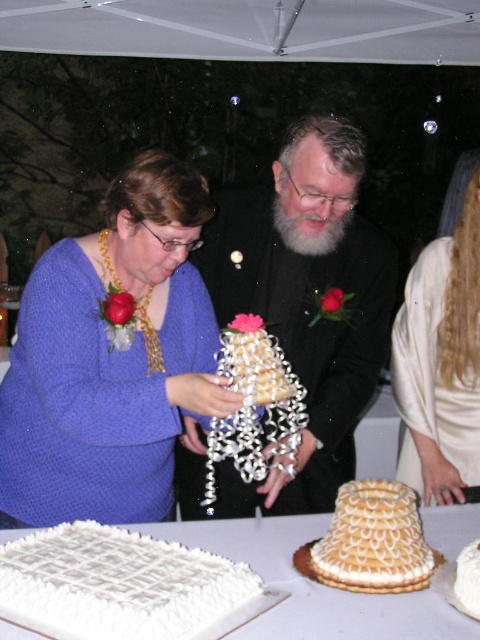
Is point (91, 284) closer to viewer compared to point (441, 556)?

No, (91, 284) is further to viewer.

From the picture: Is matte purple dress at center positioned in front of golden textured cake at center?

No.

I want to click on matte purple dress at center, so click(111, 358).

You are a GUI agent. You are given a task and a screenshot of the screen. Output one action in this format:
    pyautogui.click(x=<x>, y=<y>)
    Task: Click on the matte purple dress at center
    Image resolution: width=480 pixels, height=640 pixels.
    Given the screenshot: What is the action you would take?
    pyautogui.click(x=111, y=358)

Based on the photo, between smooth black jacket at center and matte gold necklace at center, which one appears on the right side from the viewer's perspective?

matte gold necklace at center

Does smooth black jacket at center lie in front of matte gold necklace at center?

That is True.

Describe the element at coordinates (305, 301) in the screenshot. The image size is (480, 640). I see `smooth black jacket at center` at that location.

In order to click on smooth black jacket at center in this screenshot , I will do `click(305, 301)`.

Between point (123, 582) and point (454, 422), which one is positioned behind?

Point (454, 422)

You are a GUI agent. You are given a task and a screenshot of the screen. Output one action in this format:
    pyautogui.click(x=<x>, y=<y>)
    Task: Click on the white frosted square cake at lower left
    Image resolution: width=480 pixels, height=640 pixels.
    Given the screenshot: What is the action you would take?
    pyautogui.click(x=119, y=582)